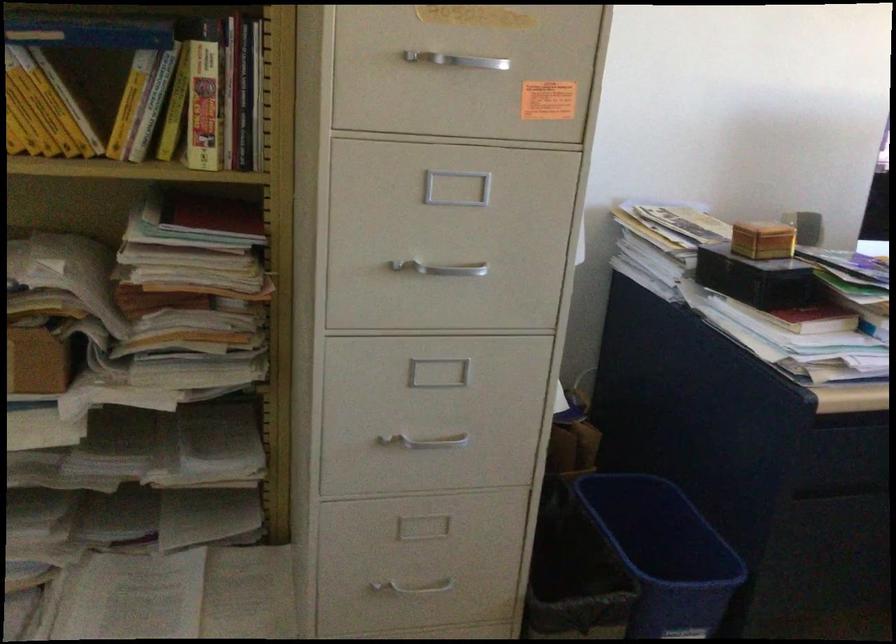
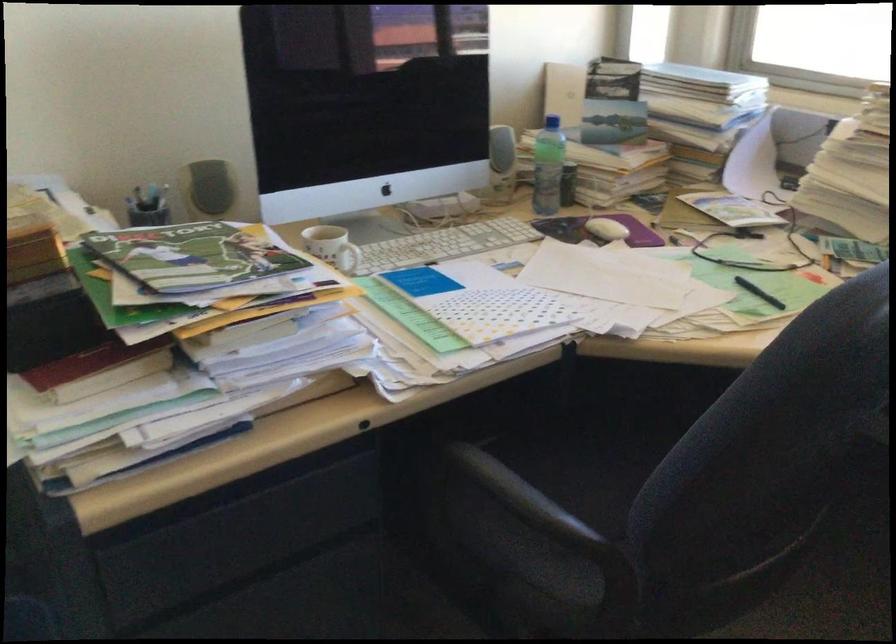
What movement of the cameraman would produce the second image?

The cameraman moved toward right, forward.